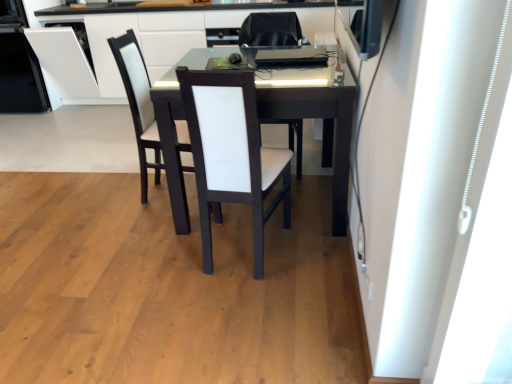
Locate an element on the screen. white leather swivel chair at center is located at coordinates (269, 33).

The image size is (512, 384). What do you see at coordinates (269, 33) in the screenshot?
I see `white leather swivel chair at center` at bounding box center [269, 33].

At what (x,y) coordinates should I click in order to perform the action: click on white leather chair at center. Please return your answer as a coordinate pair (x, y). Looking at the image, I should click on (138, 103).

Describe the element at coordinates (481, 269) in the screenshot. I see `white matte curtain at right` at that location.

In order to face white matte curtain at right, should I rotate leftwards or rightwards?

It's best to rotate right around 29.175 degrees.

Find the location of a particular element. matte black desk at center is located at coordinates (172, 32).

The height and width of the screenshot is (384, 512). I want to click on white glossy dishwasher at left, so click(19, 65).

From the image's perspective, would you say white leather chair at center is positioned over white glossy dishwasher at left?

No.

Is there a large distance between white leather chair at center and white glossy dishwasher at left?

That's right, there is a large distance between white leather chair at center and white glossy dishwasher at left.

Choose the correct answer: Is white leather chair at center inside white glossy dishwasher at left or outside it?

white leather chair at center exists outside the volume of white glossy dishwasher at left.

Between white leather chair at center and white glossy dishwasher at left, which one has more height?

With more height is white glossy dishwasher at left.

Is white glossy dishwasher at left facing away from matte black desk at center?

No, white glossy dishwasher at left is not facing away from matte black desk at center.

From the image's perspective, is white glossy dishwasher at left over matte black desk at center?

Yes, from the image's perspective, white glossy dishwasher at left is on top of matte black desk at center.

In terms of size, does white glossy dishwasher at left appear bigger or smaller than matte black desk at center?

Clearly, white glossy dishwasher at left is smaller in size than matte black desk at center.

Can you confirm if white leather swivel chair at center is taller than white glossy dishwasher at left?

No, white leather swivel chair at center is not taller than white glossy dishwasher at left.

Would you say white leather swivel chair at center is to the left or to the right of white glossy dishwasher at left in the picture?

In the image, white leather swivel chair at center appears on the right side of white glossy dishwasher at left.

Based on the photo, is white leather swivel chair at center positioned behind white glossy dishwasher at left?

No, it is in front of white glossy dishwasher at left.

From a real-world perspective, is white leather swivel chair at center located beneath white glossy dishwasher at left?

Correct, in the physical world, white leather swivel chair at center is lower than white glossy dishwasher at left.

Based on the photo, is white leather swivel chair at center beside white leather chair at center?

No, white leather swivel chair at center is not in contact with white leather chair at center.

Is point (261, 39) farther from camera compared to point (130, 85)?

Yes, point (261, 39) is behind point (130, 85).

Is white leather chair at center surrounded by white leather swivel chair at center?

That's incorrect, white leather chair at center is not inside white leather swivel chair at center.

In order to click on computer desk below the white matte curtain at right (from a real-world perspective) in this screenshot , I will do [x=172, y=32].

Which object is closer to the camera, white matte curtain at right or matte black desk at center?

white matte curtain at right is closer to the camera.

Which point is more forward, (462, 338) or (239, 9)?

The point (462, 338) is more forward.

Considering the sizes of objects white matte curtain at right and matte black desk at center in the image provided, who is taller, white matte curtain at right or matte black desk at center?

With more height is white matte curtain at right.

Does white leather swivel chair at center have a lesser width compared to white matte curtain at right?

Incorrect, the width of white leather swivel chair at center is not less than that of white matte curtain at right.

The width and height of the screenshot is (512, 384). In order to click on window that is below the white leather swivel chair at center (from the image's perspective) in this screenshot , I will do `click(481, 269)`.

Is white leather swivel chair at center touching white matte curtain at right?

No, white leather swivel chair at center is not next to white matte curtain at right.

How many degrees apart are the facing directions of white matte curtain at right and white glossy dishwasher at left?

→ The angular difference between white matte curtain at right and white glossy dishwasher at left is 90.1 degrees.

From a real-world perspective, does white matte curtain at right stand above white glossy dishwasher at left?

Yes.

Is white matte curtain at right to the left or to the right of white glossy dishwasher at left in the image?

white matte curtain at right is to the right of white glossy dishwasher at left.

Is white matte curtain at right looking in the opposite direction of white glossy dishwasher at left?

No, white glossy dishwasher at left is not at the back of white matte curtain at right.

At what (x,y) coordinates should I click in order to perform the action: click on armchair on the right of white glossy dishwasher at left. Please return your answer as a coordinate pair (x, y). Looking at the image, I should click on (138, 103).

In order to click on computer desk that is in front of the white glossy dishwasher at left in this screenshot , I will do `click(172, 32)`.

From the picture: Considering their positions, is white leather swivel chair at center positioned closer to white matte curtain at right than white leather chair at center?

Based on the image, white leather chair at center appears to be nearer to white matte curtain at right.

Looking at the image, which one is located closer to white leather chair at center, white leather chair at center, acting as the second chair starting from the back, or white matte curtain at right?

Based on the image, white leather chair at center, acting as the second chair starting from the back, appears to be nearer to white leather chair at center.

Looking at the image, which one is located closer to white leather chair at center, acting as the second chair starting from the front, white leather chair at center or white leather swivel chair at center?

Based on the image, white leather chair at center appears to be nearer to white leather chair at center, acting as the second chair starting from the front.

Estimate the real-world distances between objects in this image. Which object is closer to white leather chair at center, acting as the second chair starting from the front, white leather swivel chair at center or white leather chair at center, acting as the second chair starting from the back?

white leather chair at center, acting as the second chair starting from the back, lies closer to white leather chair at center, acting as the second chair starting from the front, than the other object.

From the image, which object appears to be nearer to white leather chair at center, which is the first chair from back to front, white glossy dishwasher at left or white leather swivel chair at center?

Among the two, white leather swivel chair at center is located nearer to white leather chair at center, which is the first chair from back to front.

When comparing their distances from white leather chair at center, the first chair in the front-to-back sequence, does white leather swivel chair at center or white matte curtain at right seem closer?

Based on the image, white leather swivel chair at center appears to be nearer to white leather chair at center, the first chair in the front-to-back sequence.

Looking at the image, which one is located further to white leather chair at center, white leather chair at center, which is the first chair from back to front, or white leather swivel chair at center?

white leather swivel chair at center is positioned further to the anchor white leather chair at center.

Consider the image. When comparing their distances from white glossy dishwasher at left, does white leather chair at center, which is the first chair from back to front, or matte black desk at center seem further?

The object further to white glossy dishwasher at left is white leather chair at center, which is the first chair from back to front.

In order to click on armchair between white matte curtain at right and white leather swivel chair at center from front to back in this screenshot , I will do `click(138, 103)`.

Identify the location of armchair situated between white glossy dishwasher at left and white leather chair at center, acting as the second chair starting from the back, from left to right. This screenshot has width=512, height=384. (138, 103).

Locate an element on the screen. The width and height of the screenshot is (512, 384). chair positioned between white leather chair at center, acting as the second chair starting from the back, and white leather chair at center from near to far is located at coordinates (139, 103).

You are a GUI agent. You are given a task and a screenshot of the screen. Output one action in this format:
    pyautogui.click(x=<x>, y=<y>)
    Task: Click on the computer desk between white matte curtain at right and white glossy dishwasher at left from front to back
    This screenshot has width=512, height=384.
    Given the screenshot: What is the action you would take?
    (172, 32)